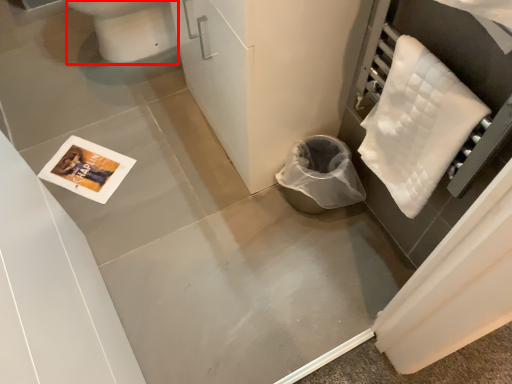
Question: From the image, what is the correct spatial relationship of toilet bowl (annotated by the red box) in relation to cloth?

Choices:
 (A) left
 (B) right

Answer: (A)